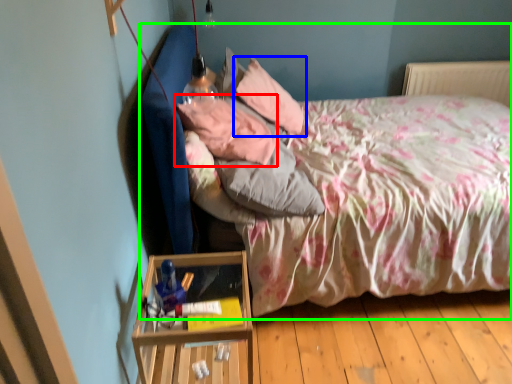
Question: Which object is the closest to the pillow (highlighted by a red box)? Choose among these: pillow (highlighted by a blue box) or bed (highlighted by a green box).

Choices:
 (A) pillow
 (B) bed

Answer: (A)